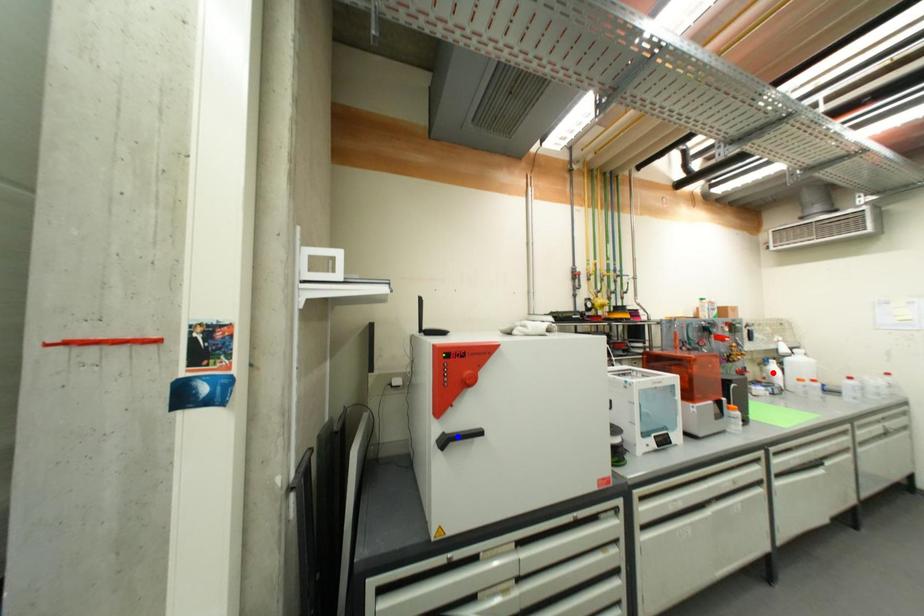
Question: Two points are marked on the image. Which point is closer to the camera?

Choices:
 (A) Blue point is closer.
 (B) Red point is closer.

Answer: (A)